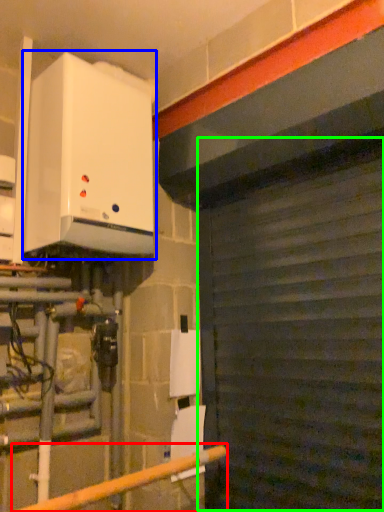
Question: Which is farther away from rail (highlighted by a red box)? home appliance (highlighted by a blue box) or garage door (highlighted by a green box)?

Choices:
 (A) home appliance
 (B) garage door

Answer: (A)